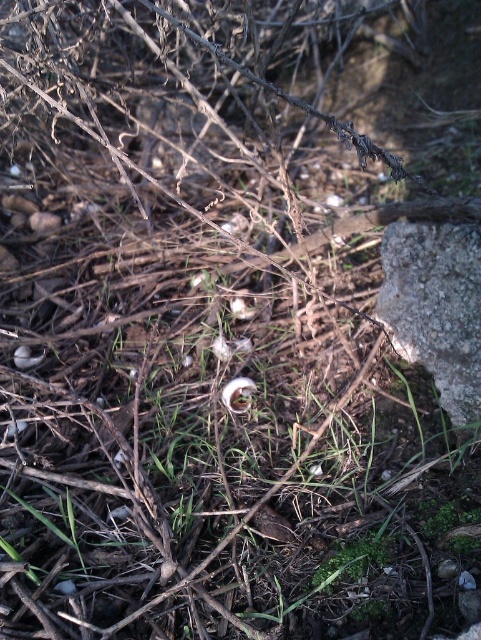
You are an artist setting up an easel to paint the scene. You want to focus on the gray rough stone at right and the white matte flower at center. Which object should you place in the foreground of your painting to maintain the scene perspective?

The gray rough stone at right should be placed in the foreground of your painting because it is closer to the viewer than the white matte flower at center, aligning with the scene perspective.

You are an artist planning to sketch the scene. You want to draw the gray rough stone at right first. Which direction should you look from the white matte flower at center to find it?

The gray rough stone at right is to the right of the white matte flower at center, so you should look to the right direction from the white matte flower at center to find it.